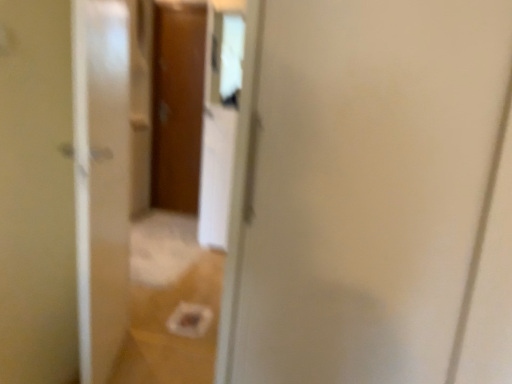
Question: Should I look upward or downward to see wooden door at center?

Choices:
 (A) down
 (B) up

Answer: (B)

Question: Does transparent glass screen door at left have a greater width compared to wooden door at center?

Choices:
 (A) no
 (B) yes

Answer: (B)

Question: Is wooden door at center inside transparent glass screen door at left?

Choices:
 (A) no
 (B) yes

Answer: (A)

Question: Is transparent glass screen door at left located outside wooden door at center?

Choices:
 (A) yes
 (B) no

Answer: (A)

Question: Does transparent glass screen door at left appear on the right side of wooden door at center?

Choices:
 (A) yes
 (B) no

Answer: (A)

Question: From the image's perspective, is transparent glass screen door at left below wooden door at center?

Choices:
 (A) no
 (B) yes

Answer: (B)

Question: Could you tell me if transparent glass screen door at left is turned towards wooden door at center?

Choices:
 (A) no
 (B) yes

Answer: (A)

Question: Is transparent glass door at center smaller than transparent glass screen door at left?

Choices:
 (A) no
 (B) yes

Answer: (B)

Question: Would you say transparent glass door at center contains transparent glass screen door at left?

Choices:
 (A) no
 (B) yes

Answer: (A)

Question: From a real-world perspective, is transparent glass door at center on top of transparent glass screen door at left?

Choices:
 (A) yes
 (B) no

Answer: (A)

Question: Does transparent glass door at center lie in front of transparent glass screen door at left?

Choices:
 (A) no
 (B) yes

Answer: (A)

Question: Is transparent glass door at center at the left side of transparent glass screen door at left?

Choices:
 (A) yes
 (B) no

Answer: (B)

Question: From a real-world perspective, is transparent glass door at center positioned under transparent glass screen door at left based on gravity?

Choices:
 (A) no
 (B) yes

Answer: (A)

Question: Could you tell me if wooden door at center is turned towards transparent glass screen door at left?

Choices:
 (A) yes
 (B) no

Answer: (B)